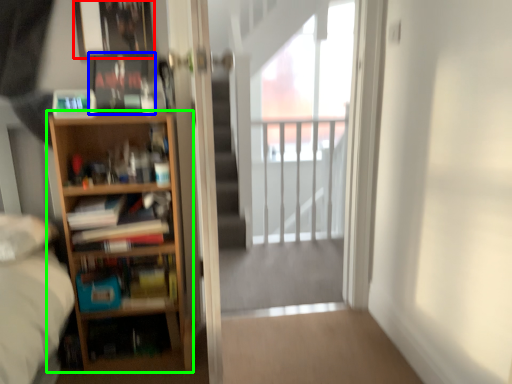
Question: Which is farther away from picture frame (highlighted by a red box)? book (highlighted by a blue box) or bookcase (highlighted by a green box)?

Choices:
 (A) book
 (B) bookcase

Answer: (B)